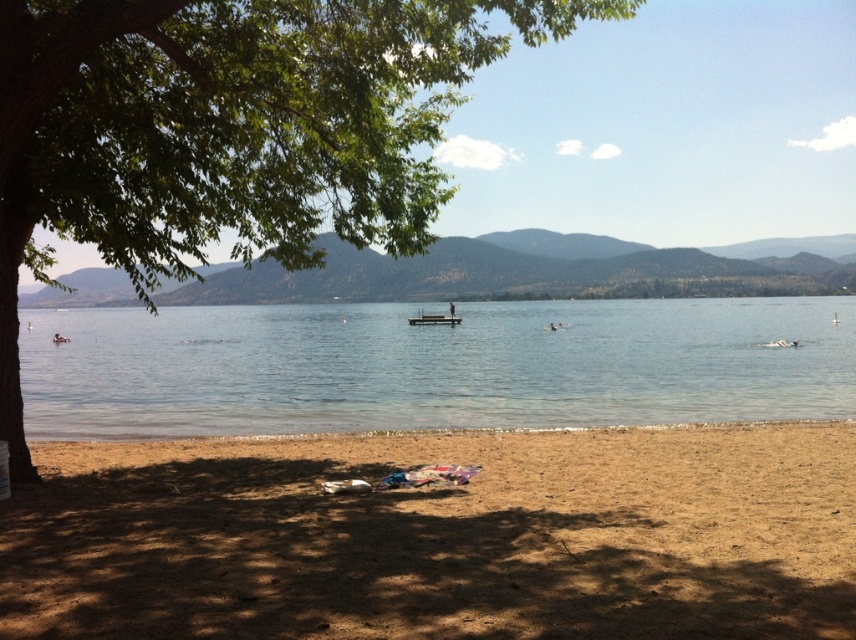
Question: Is green leafy tree at lower left bigger than wooden dock at center?

Choices:
 (A) no
 (B) yes

Answer: (B)

Question: Which object is farther from the camera taking this photo?

Choices:
 (A) clear blue water at center
 (B) green leafy tree at lower left
 (C) brown sandy beach at lower center
 (D) wooden dock at center

Answer: (D)

Question: Which of the following is the closest to the observer?

Choices:
 (A) (58, 499)
 (B) (128, 422)

Answer: (A)

Question: Does brown sandy beach at lower center appear on the left side of green leafy tree at lower left?

Choices:
 (A) no
 (B) yes

Answer: (A)

Question: Where is brown sandy beach at lower center located in relation to green leafy tree at lower left in the image?

Choices:
 (A) below
 (B) above

Answer: (A)

Question: Which object is closer to the camera taking this photo?

Choices:
 (A) green leafy tree at lower left
 (B) wooden dock at center
 (C) clear blue water at center
 (D) brown sandy beach at lower center

Answer: (D)